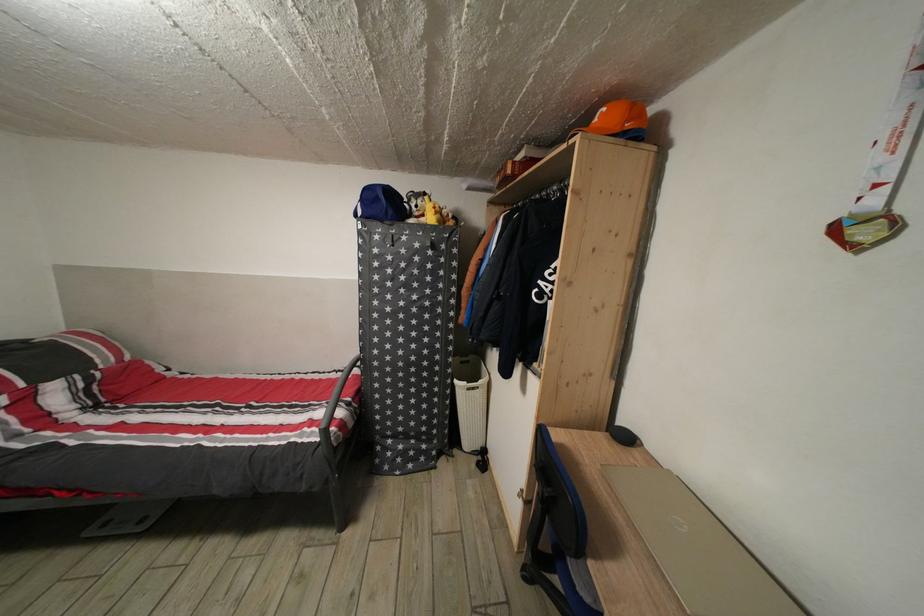
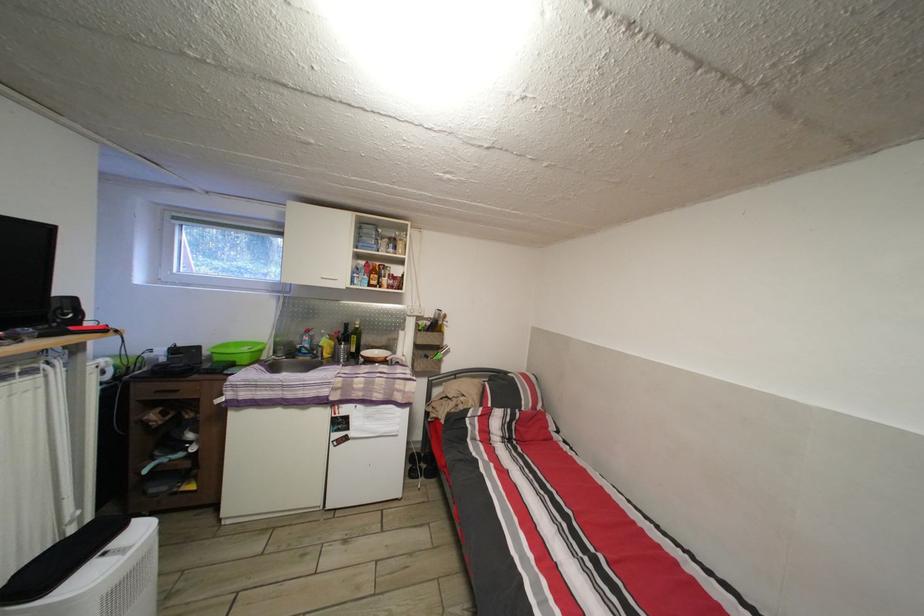
Question: How did the camera likely rotate?

Choices:
 (A) Left
 (B) Right
 (C) Up
 (D) Down

Answer: (A)